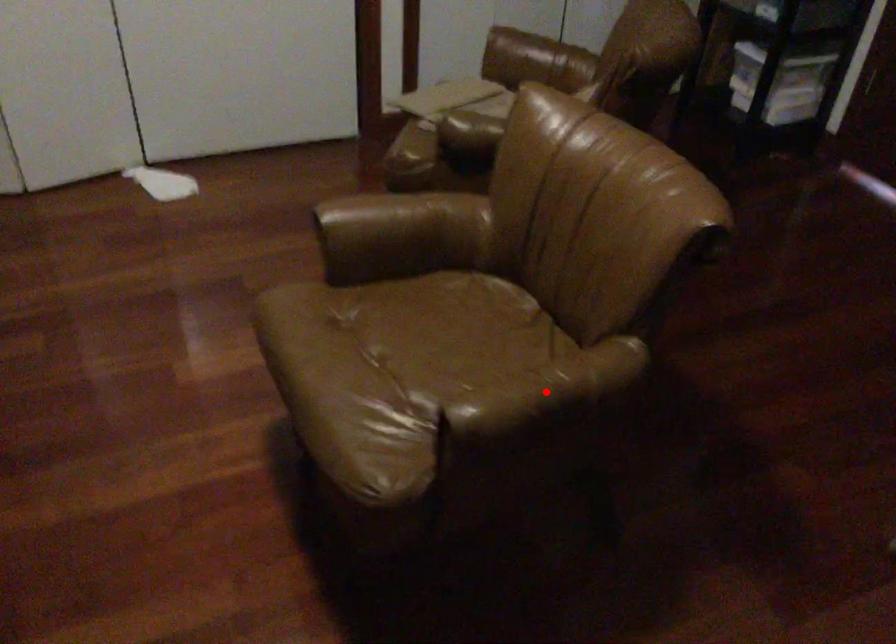
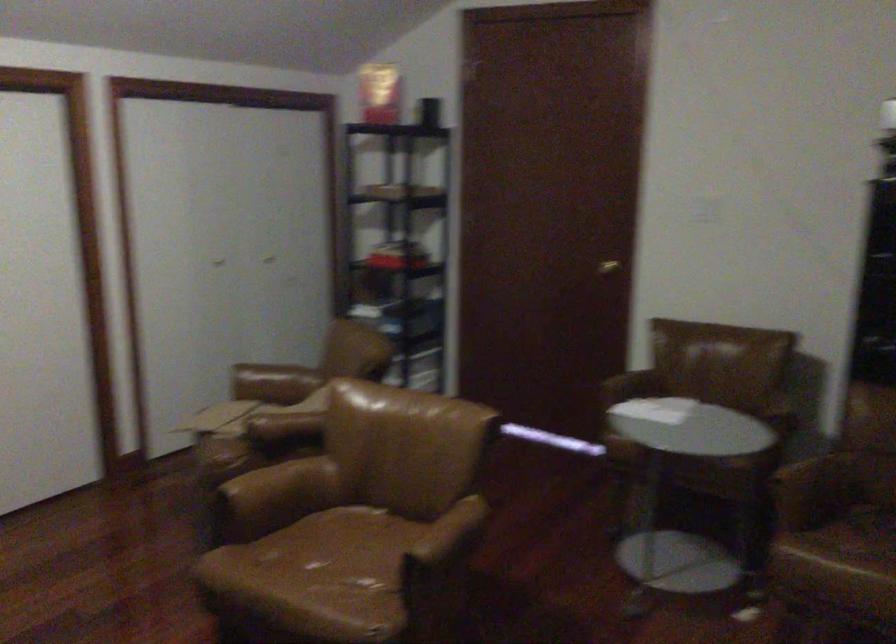
Question: I am providing you with two images of the same scene from different viewpoints. A red point is shown in image1. For the corresponding object point in image2, is it positioned nearer or farther from the camera?

Choices:
 (A) Nearer
 (B) Farther

Answer: (B)